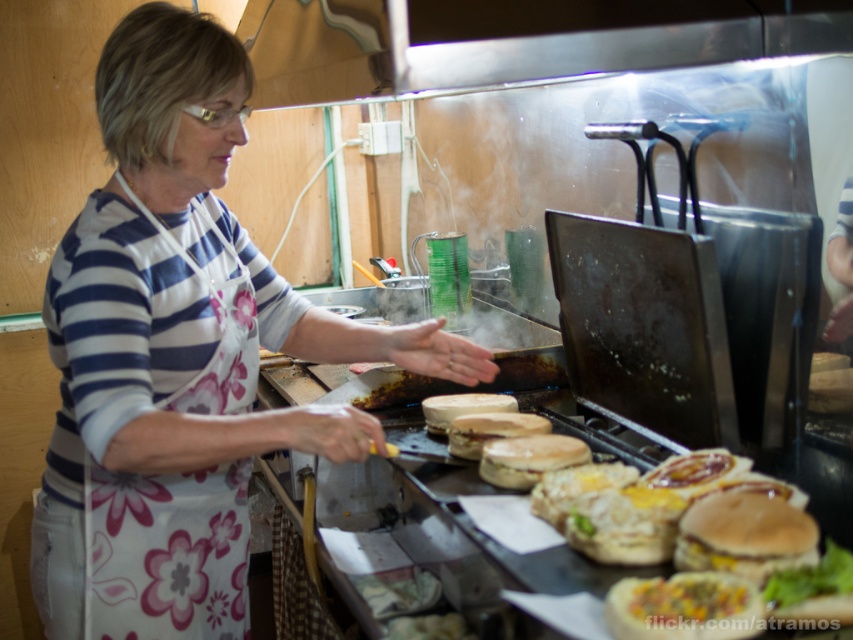
You are a customer waiting to place an order at the food stall. You see the white floral apron at center and the slightly toasted bun at center. Which item is positioned more to the left?

The white floral apron at center is to the left of the slightly toasted bun at center, so it is positioned more to the left.